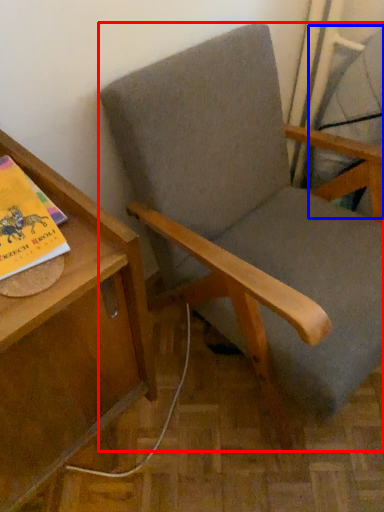
Question: Which object is further to the camera taking this photo, chair (highlighted by a red box) or swivel chair (highlighted by a blue box)?

Choices:
 (A) chair
 (B) swivel chair

Answer: (B)